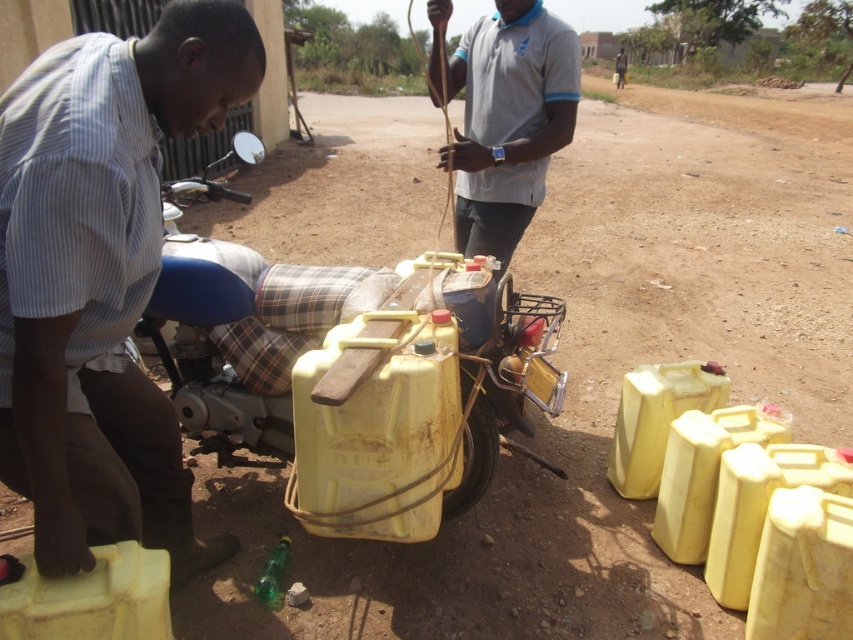
Question: Among these points, which one is nearest to the camera?

Choices:
 (A) (525, 40)
 (B) (0, 449)

Answer: (B)

Question: Which point is farther to the camera?

Choices:
 (A) (91, 461)
 (B) (476, 38)

Answer: (B)

Question: Does matte blue motorcycle at lower left appear under gray cotton shirt at upper center?

Choices:
 (A) no
 (B) yes

Answer: (B)

Question: Can you confirm if matte blue motorcycle at lower left is positioned above gray cotton shirt at upper center?

Choices:
 (A) yes
 (B) no

Answer: (B)

Question: Which object is closer to the camera taking this photo?

Choices:
 (A) matte blue motorcycle at lower left
 (B) gray cotton shirt at upper center

Answer: (A)

Question: Is matte blue motorcycle at lower left in front of gray cotton shirt at upper center?

Choices:
 (A) no
 (B) yes

Answer: (B)